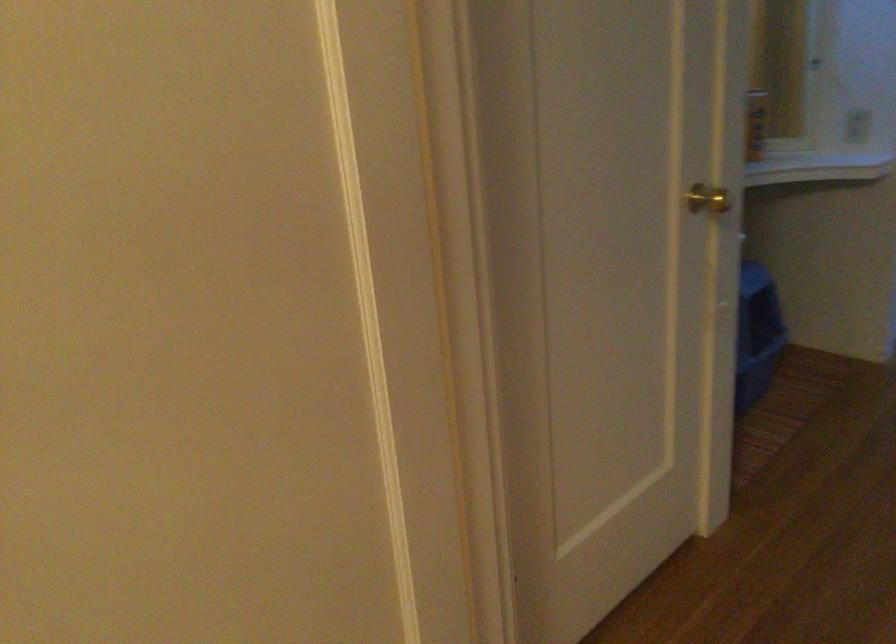
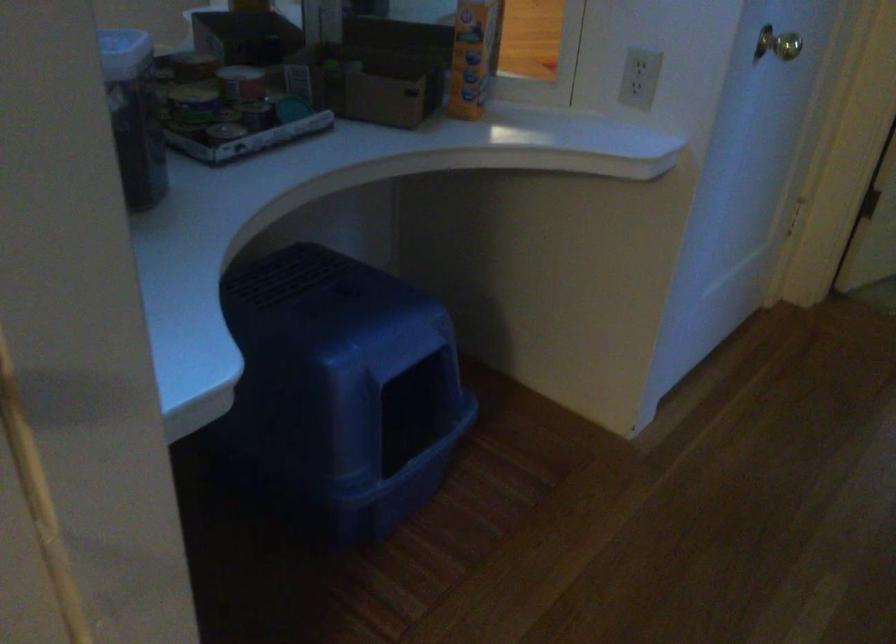
Which direction would the cameraman need to move to produce the second image?

The cameraman moved toward right, forward.